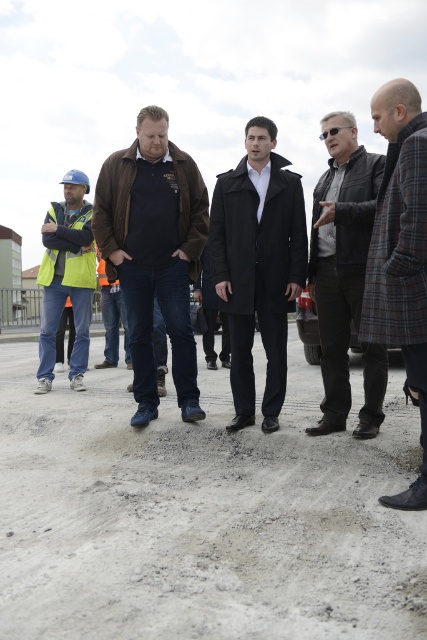
Does gray gravel at center have a greater height compared to black wool coat at center?

No, gray gravel at center is not taller than black wool coat at center.

Locate an element on the screen. The image size is (427, 640). gray gravel at center is located at coordinates (202, 515).

Which is behind, point (107, 540) or point (254, 280)?

Point (254, 280)

Identify the location of gray gravel at center. (202, 515).

Is brown leather jacket at center further to camera compared to plaid wool coat at right?

Yes, brown leather jacket at center is further from the viewer.

Between brown leather jacket at center and plaid wool coat at right, which one is positioned lower?

Positioned lower is plaid wool coat at right.

Locate an element on the screen. The width and height of the screenshot is (427, 640). brown leather jacket at center is located at coordinates (154, 252).

Can you confirm if plaid wool coat at right is smaller than high visibility yellow vest at left?

Indeed, plaid wool coat at right has a smaller size compared to high visibility yellow vest at left.

Is plaid wool coat at right to the left of high visibility yellow vest at left from the viewer's perspective?

No, plaid wool coat at right is not to the left of high visibility yellow vest at left.

Where is `plaid wool coat at right`? The height and width of the screenshot is (640, 427). plaid wool coat at right is located at coordinates (400, 253).

You are a GUI agent. You are given a task and a screenshot of the screen. Output one action in this format:
    pyautogui.click(x=<x>, y=<y>)
    Task: Click on the plaid wool coat at right
    
    Given the screenshot: What is the action you would take?
    pyautogui.click(x=400, y=253)